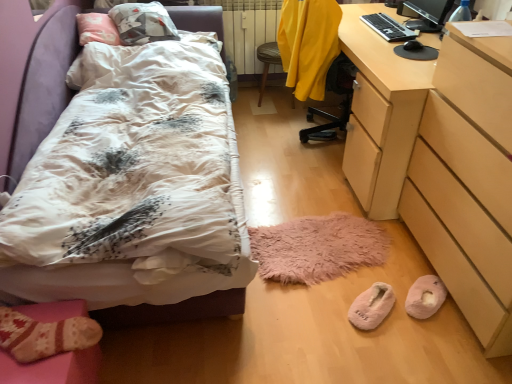
Question: In the image, is knitted wool socks at lower left on the left side or the right side of black plastic keyboard at upper right?

Choices:
 (A) left
 (B) right

Answer: (A)

Question: Is knitted wool socks at lower left bigger or smaller than black plastic keyboard at upper right?

Choices:
 (A) small
 (B) big

Answer: (B)

Question: Which is nearer to the black glossy monitor at upper right?

Choices:
 (A) white floral duvet at left
 (B) pink fuzzy slippers at lower center, which is counted as the first footwear, starting from the left
 (C) pink fluffy slippers at lower right, the second footwear positioned from the left
 (D) black plastic keyboard at upper right
 (E) yellow fabric swivel chair at center, the second swivel chair when ordered from front to back

Answer: (D)

Question: Estimate the real-world distances between objects in this image. Which object is farther from the white floral duvet at left?

Choices:
 (A) yellow fabric swivel chair at center, the 2th swivel chair viewed from the back
 (B) knitted wool socks at lower left
 (C) light wood desk at right
 (D) yellow fabric swivel chair at center, arranged as the first swivel chair when viewed from the back
 (E) pink fluffy slippers at lower right, the second footwear positioned from the left

Answer: (E)